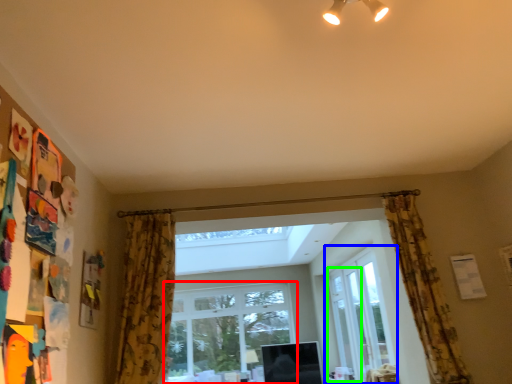
Question: Estimate the real-world distances between objects in this image. Which object is closer to window (highlighted by a red box), window (highlighted by a blue box) or screen door (highlighted by a green box)?

Choices:
 (A) window
 (B) screen door

Answer: (B)